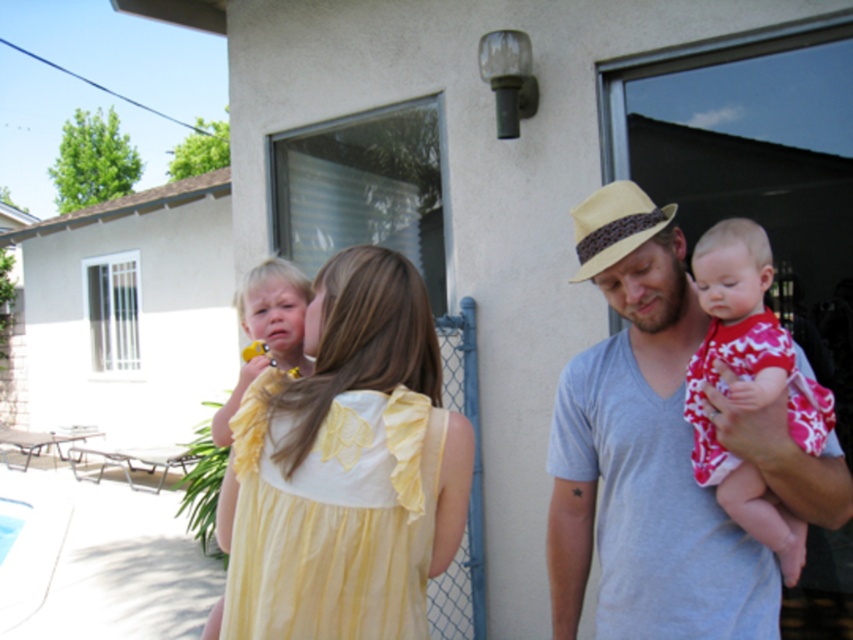
Question: Among these objects, which one is farthest from the camera?

Choices:
 (A) gray cotton shirt at center
 (B) yellow chiffon dress at center
 (C) straw hat at center

Answer: (C)

Question: Can you confirm if gray cotton shirt at center is wider than printed cotton dress at right?

Choices:
 (A) yes
 (B) no

Answer: (A)

Question: Is yellow cotton dress at center above straw hat at center?

Choices:
 (A) yes
 (B) no

Answer: (B)

Question: Can you confirm if yellow chiffon dress at center is positioned to the left of printed cotton dress at right?

Choices:
 (A) yes
 (B) no

Answer: (A)

Question: Which point is farther to the camera?

Choices:
 (A) (666, 448)
 (B) (286, 330)
 (C) (399, 528)
 (D) (595, 224)

Answer: (B)

Question: Estimate the real-world distances between objects in this image. Which object is farther from the straw hat at center?

Choices:
 (A) gray cotton shirt at center
 (B) yellow cotton dress at center

Answer: (B)